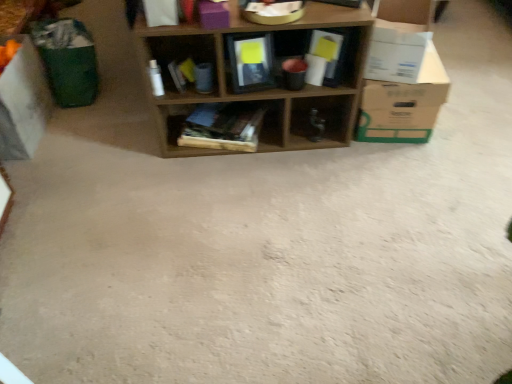
Question: From a real-world perspective, relative to wooden books at center, the 2th shelf positioned from the right, is white cardboard box at left, acting as the 3th cardboard box starting from the right, vertically above or below?

Choices:
 (A) above
 (B) below

Answer: (A)

Question: Would you say white cardboard box at left, acting as the 3th cardboard box starting from the right, is inside or outside wooden books at center, the 2th shelf positioned from the right?

Choices:
 (A) inside
 (B) outside

Answer: (B)

Question: Estimate the real-world distances between objects in this image. Which object is farther from the wooden books at center, the 2th shelf positioned from the right?

Choices:
 (A) wooden frame at center, the 3th shelf in the right-to-left sequence
 (B) white cardboard box at right, the 2th cardboard box when ordered from right to left
 (C) purple matte storage box at upper center
 (D) wooden shelf at center, which is counted as the first shelf, starting from the right
 (E) white cardboard box at right, which is counted as the first cardboard box, starting from the right

Answer: (B)

Question: Which of these objects is positioned farthest from the wooden books at center, the 2th shelf positioned from the right?

Choices:
 (A) white cardboard box at left, placed as the 1th cardboard box when sorted from left to right
 (B) purple matte storage box at upper center
 (C) white cardboard box at right, which is counted as the first cardboard box, starting from the right
 (D) wooden frame at center, the first shelf when ordered from left to right
 (E) wooden shelf at center, which is counted as the first shelf, starting from the right

Answer: (A)